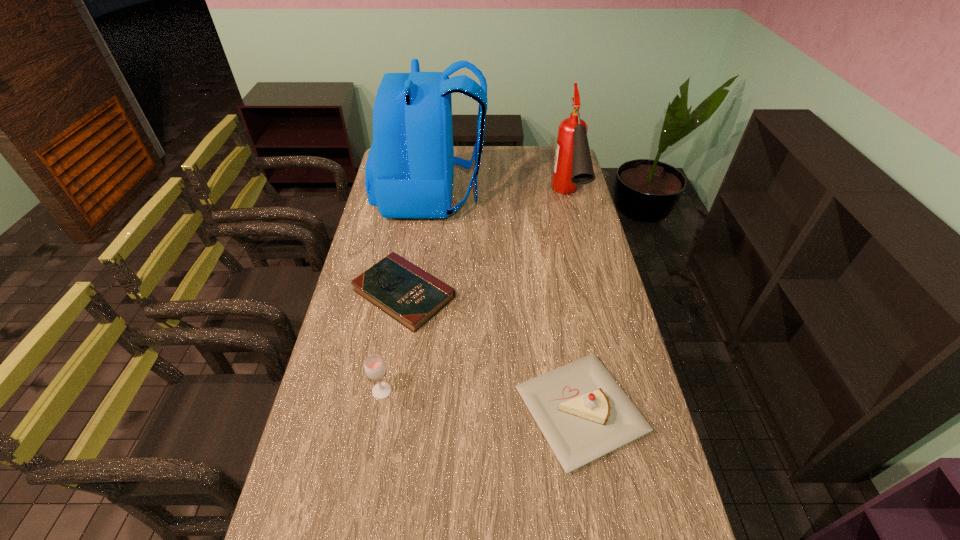
Find the location of a particular element. vacant space at the far right corner is located at coordinates (552, 158).

Find the location of a particular element. This screenshot has width=960, height=540. vacant space that's between the fire extinguisher and the Bible is located at coordinates (486, 248).

The image size is (960, 540). I want to click on vacant region between the Bible and the cake, so click(x=492, y=352).

Find the location of a particular element. free space between the cake and the third shortest object is located at coordinates pos(481,401).

The height and width of the screenshot is (540, 960). Find the location of `the third closest object to the Bible`. the third closest object to the Bible is located at coordinates (583, 413).

Locate an element on the screen. This screenshot has height=540, width=960. object that stands as the second closest to the backpack is located at coordinates (572, 165).

I want to click on free space in the image that satisfies the following two spatial constraints: 1. on the back of the tallest object; 2. on the back side of the cake, so click(403, 411).

Where is `free space that satisfies the following two spatial constraints: 1. on the back side of the second shortest object; 2. on the back of the backpack`? free space that satisfies the following two spatial constraints: 1. on the back side of the second shortest object; 2. on the back of the backpack is located at coordinates (543, 196).